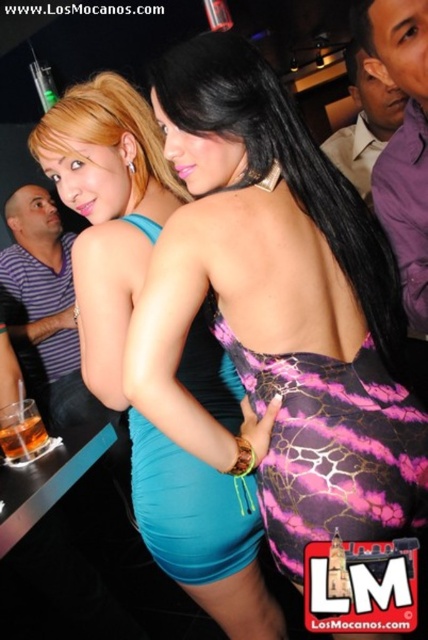
You are a photographer trying to capture the entire scene in one shot. Given the pink cracked fabric dress at center and the purple shirt at upper right, which object should you focus on to ensure both are visible without cropping?

The pink cracked fabric dress at center occupies less space than the purple shirt at upper right, so focusing on the purple shirt at upper right would help ensure both objects are visible in the frame without cropping.

You are a photographer adjusting your camera settings to focus on two specific points in the image. The first point is at coordinate point(53,355) and the second is at point(23,428). Which point is closer to your camera lens?

Point(53,355) is closer to the camera lens than point(23,428) because it is further to the viewer in the image.

You are a bartender preparing to serve a drink to the woman wearing the striped shirt at left and the person holding the translucent glass drink at lower left. Which object is wider so you can decide where to place them?

The striped shirt at left is wider than the translucent glass drink at lower left, so you should place the wider striped shirt at left in a spot that accommodates its size.